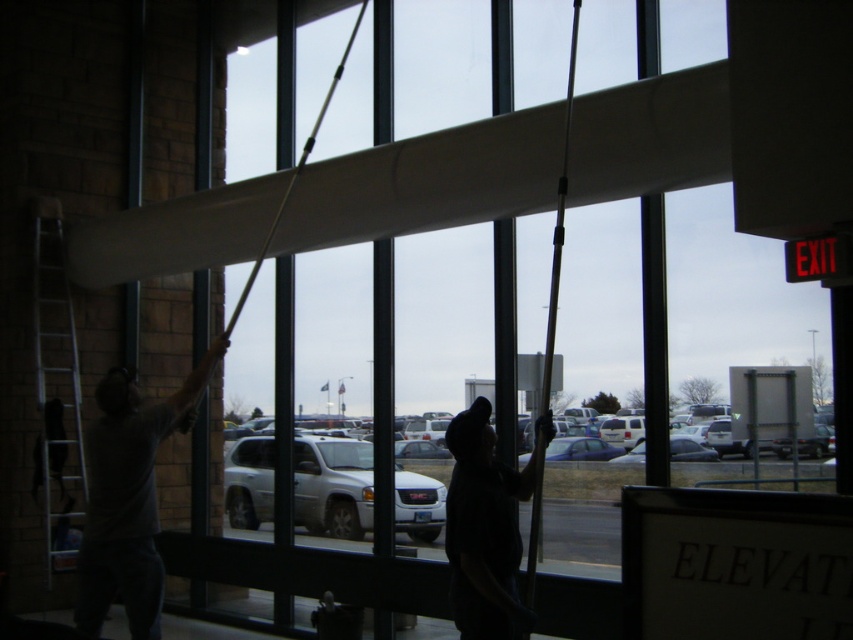
You are standing in the parking lot looking through the large windows into the building. You notice the dark gray fabric at center and the silver metallic ladder at left. Which object is closer to the bottom of the window?

The dark gray fabric at center is closer to the bottom of the window because it is positioned below the silver metallic ladder at left.

You are standing in front of the window and see the dark gray shirt at left and the silver metallic ladder at left. Which object is closer to your right side?

The dark gray shirt at left is closer to your right side because it is positioned to the right of the silver metallic ladder at left.

Based on the provided scene description, what object corresponds to the coordinates point (428,182)?

The white smooth beam at center corresponds to the coordinates point (428,182).